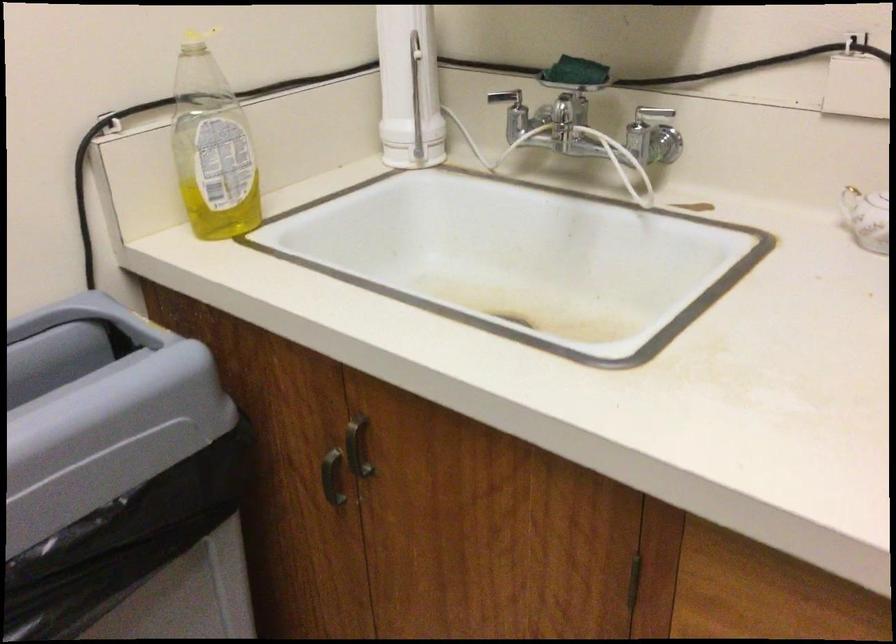
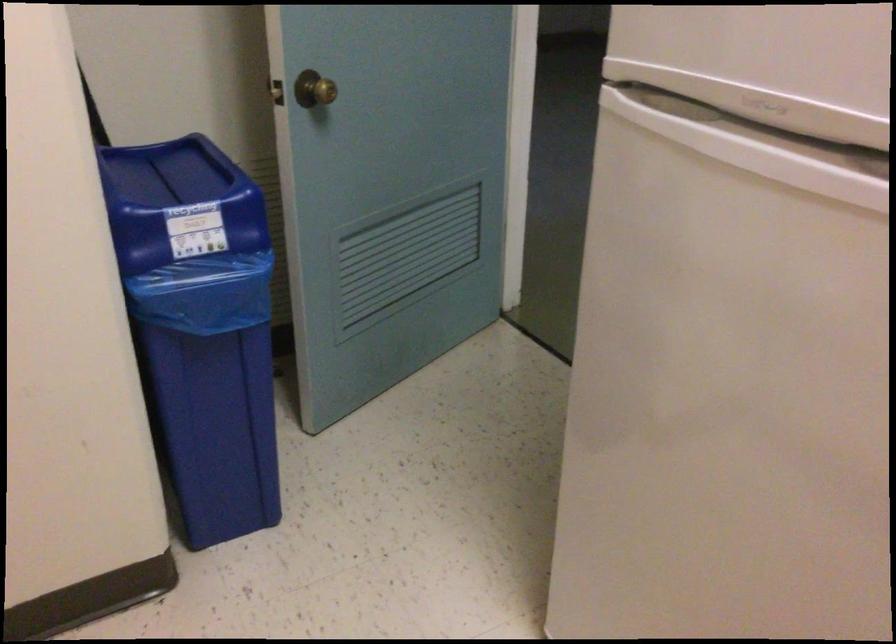
How did the camera likely rotate?

The camera's rotation is toward left-down.